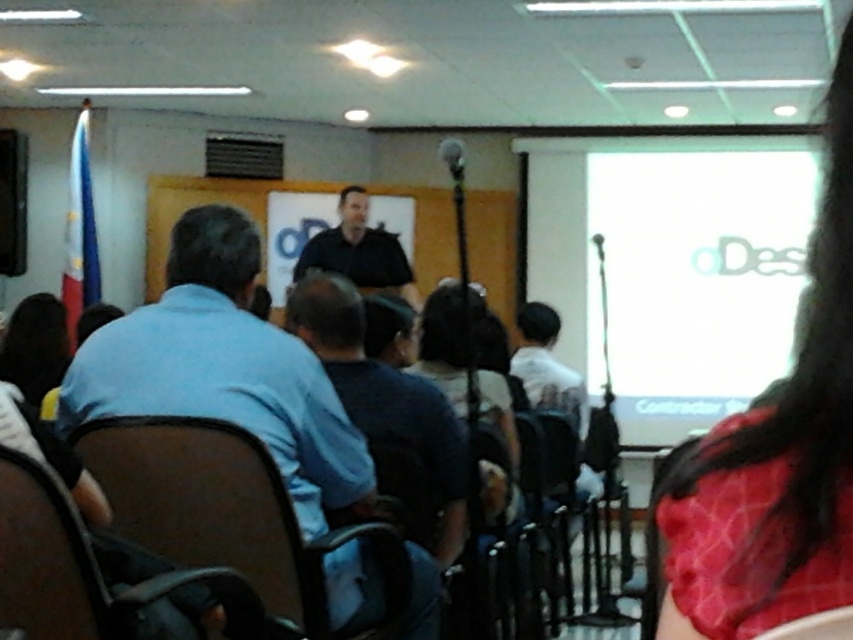
Question: Is red satin hair at upper right to the right of dark blue shirt at center from the viewer's perspective?

Choices:
 (A) yes
 (B) no

Answer: (A)

Question: Can you confirm if red satin hair at upper right is positioned to the right of matte black chair at center?

Choices:
 (A) yes
 (B) no

Answer: (A)

Question: Estimate the real-world distances between objects in this image. Which object is farther from the black matte shirt at center?

Choices:
 (A) matte black chair at center
 (B) brown leather chair at center

Answer: (A)

Question: Which of the following is the closest to the observer?

Choices:
 (A) (845, 618)
 (B) (83, 364)
 (C) (378, 390)
 (D) (650, 396)

Answer: (A)

Question: Which is farther from the white matte projection screen at upper right?

Choices:
 (A) black smooth shirt at center
 (B) brown leather chair at lower left
 (C) matte black chair at center

Answer: (C)

Question: Where is white matte projection screen at upper right located in relation to dark blue shirt at center in the image?

Choices:
 (A) above
 (B) below

Answer: (A)